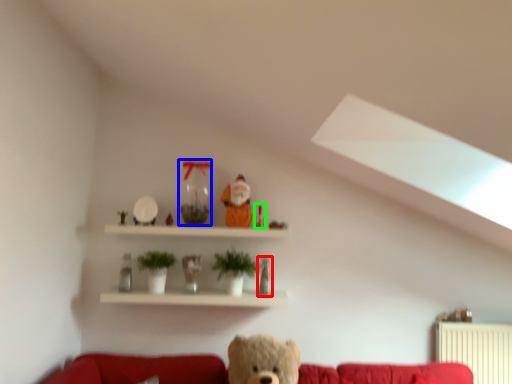
Question: Which object is positioned farthest from figurine (highlighted by a red box)? Select from glass vase (highlighted by a blue box) and toy (highlighted by a green box).

Choices:
 (A) glass vase
 (B) toy

Answer: (A)